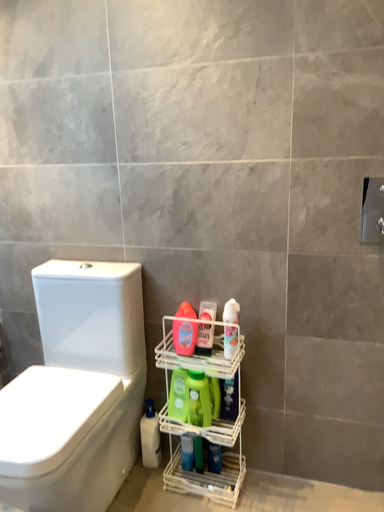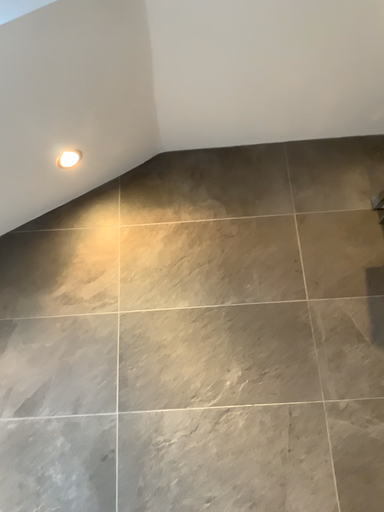
Question: Which way did the camera rotate in the video?

Choices:
 (A) rotated left
 (B) rotated right

Answer: (B)